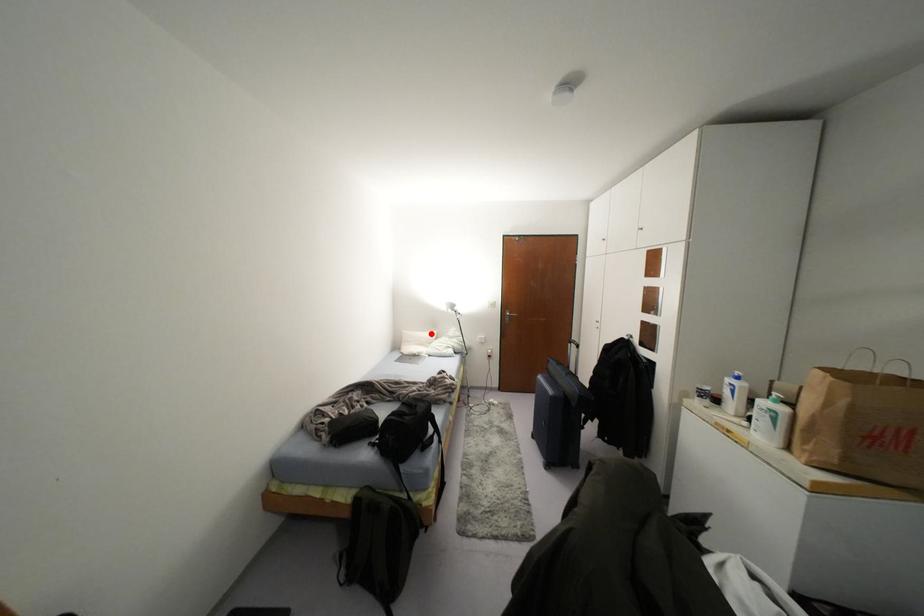
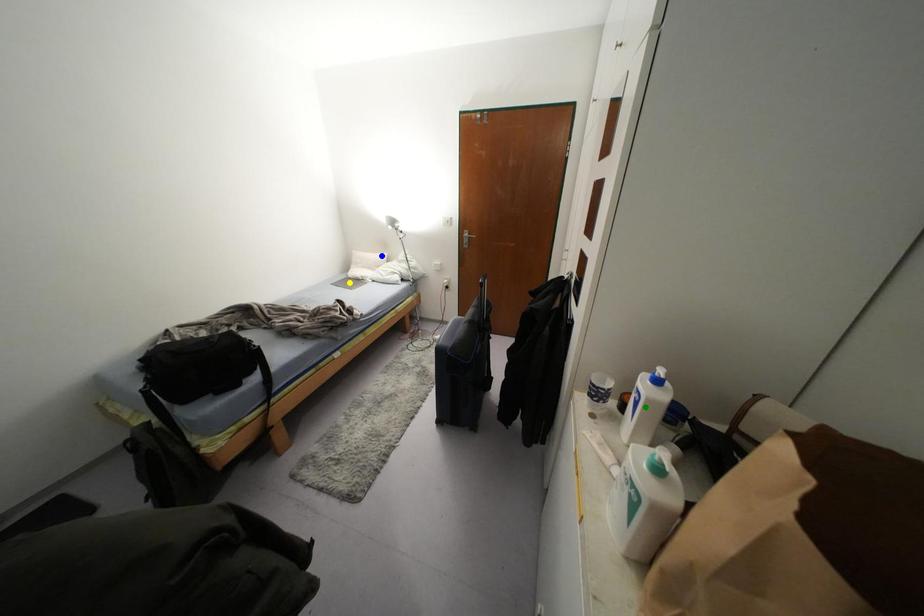
Question: I am providing you with two images of the same scene from different viewpoints. A red point is marked on the first image. You are given multiple points on the second image. Which mark in image 2 goes with the point in image 1?

Choices:
 (A) yellow point
 (B) blue point
 (C) green point

Answer: (B)